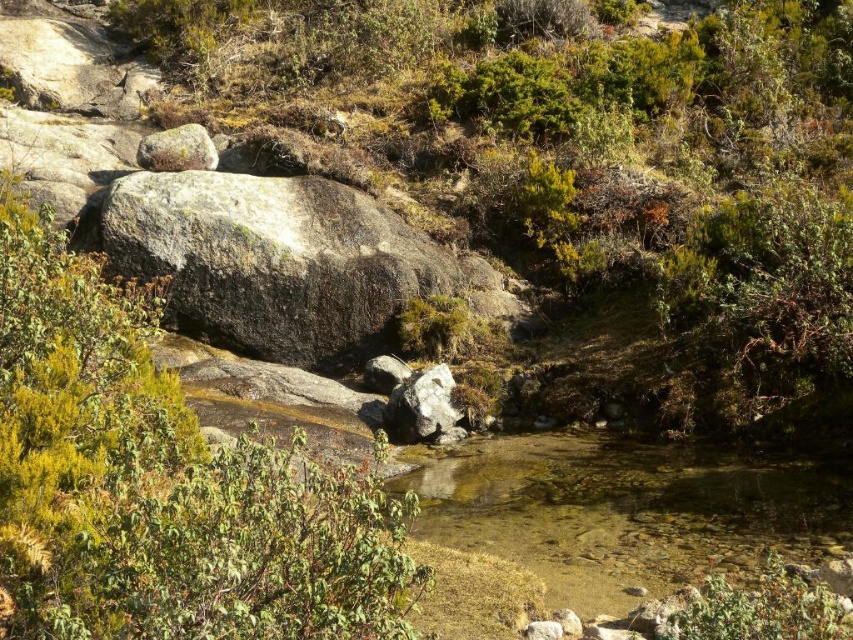
Is green leafy shrub at left to the right of clear water at center from the viewer's perspective?

No, green leafy shrub at left is not to the right of clear water at center.

Consider the image. Who is shorter, green leafy shrub at left or clear water at center?

clear water at center is shorter.

In order to click on green leafy shrub at left in this screenshot , I will do `click(161, 483)`.

Which is in front, point (96, 620) or point (454, 403)?

Point (96, 620)

Between green leafy shrub at left and gray rough rock at center, which one appears on the right side from the viewer's perspective?

Positioned to the right is gray rough rock at center.

Between point (339, 580) and point (444, 376), which one is positioned in front?

Point (339, 580) is more forward.

Find the location of a particular element. This screenshot has width=853, height=640. green leafy shrub at left is located at coordinates (161, 483).

Can you confirm if green shrubbery at center is positioned above green leafy shrub at left?

Indeed, green shrubbery at center is positioned over green leafy shrub at left.

Image resolution: width=853 pixels, height=640 pixels. In order to click on green shrubbery at center in this screenshot , I will do `click(585, 160)`.